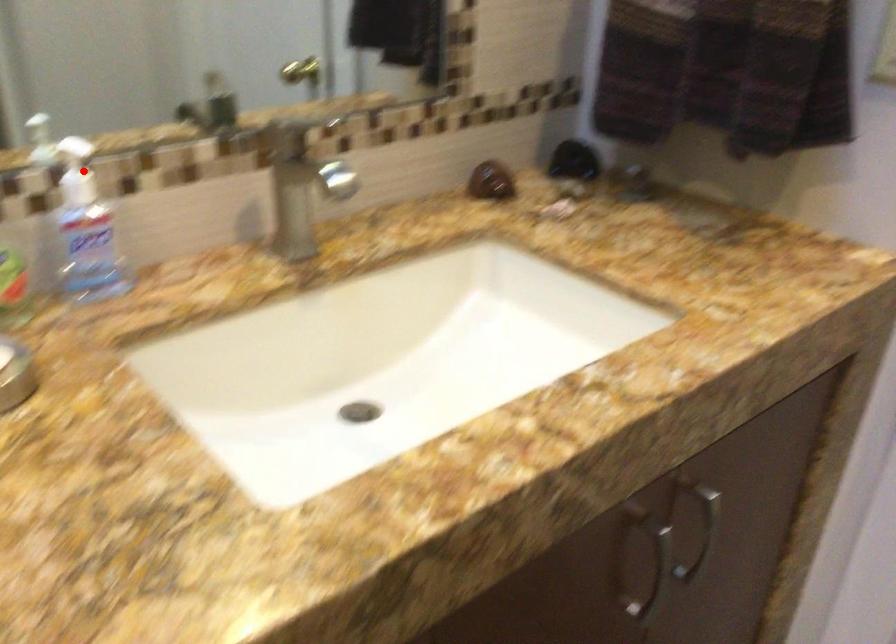
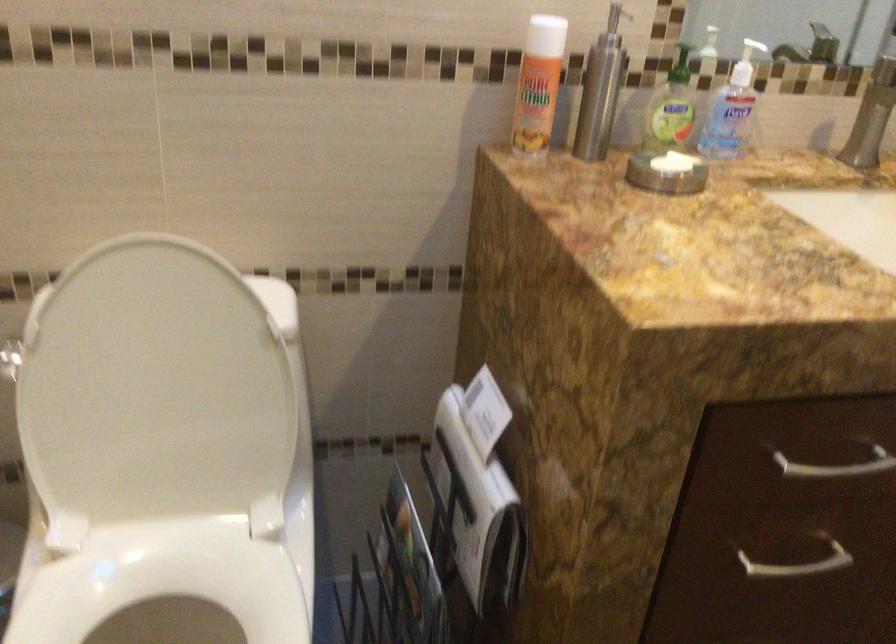
Question: I am providing you with two images of the same scene from different viewpoints. A red point is marked on the first image. At the location where the point appears in image 1, is it still visible in image 2?

Choices:
 (A) Yes
 (B) No

Answer: (A)